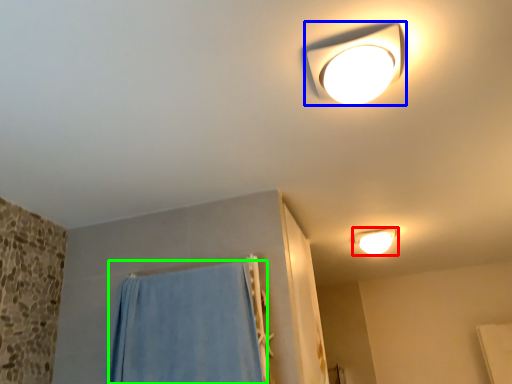
Question: Considering the real-world distances, which object is farthest from lamp (highlighted by a red box)? lamp (highlighted by a blue box) or curtain (highlighted by a green box)?

Choices:
 (A) lamp
 (B) curtain

Answer: (A)